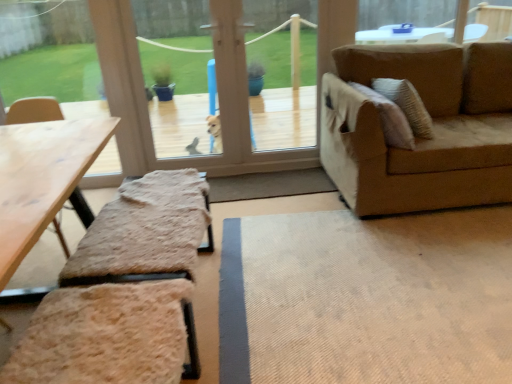
Question: Is transparent plastic dog at center inside or outside of wooden picnic table at lower left?

Choices:
 (A) outside
 (B) inside

Answer: (A)

Question: In terms of height, does transparent plastic dog at center look taller or shorter compared to wooden picnic table at lower left?

Choices:
 (A) short
 (B) tall

Answer: (B)

Question: Is point (148, 59) positioned closer to the camera than point (38, 178)?

Choices:
 (A) farther
 (B) closer

Answer: (A)

Question: Is wooden picnic table at lower left inside the boundaries of transparent plastic dog at center, or outside?

Choices:
 (A) inside
 (B) outside

Answer: (B)

Question: In the image, is wooden picnic table at lower left positioned in front of or behind transparent plastic dog at center?

Choices:
 (A) front
 (B) behind

Answer: (A)

Question: In terms of width, does wooden picnic table at lower left look wider or thinner when compared to transparent plastic dog at center?

Choices:
 (A) wide
 (B) thin

Answer: (A)

Question: Is wooden picnic table at lower left to the left or to the right of transparent plastic dog at center in the image?

Choices:
 (A) right
 (B) left

Answer: (B)